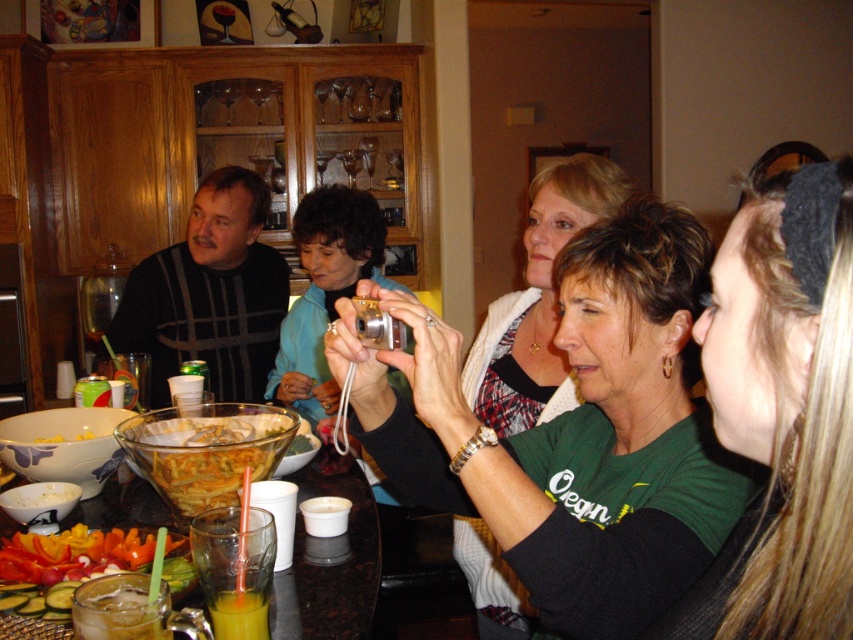
You are a guest at the party and want to take a photo of the green matte shirt at center without it being blocked by the translucent glass cup at lower left. Based on their sizes, is this possible?

The green matte shirt at center is taller than the translucent glass cup at lower left, so it might be possible to position the camera angle higher to ensure the shirt isn

You are at a party and want to grab a drink. You see the translucent glass cup at lower left and the yellow matte corn at center. Which object is closer to your current position if you are standing at the table?

The translucent glass cup at lower left is to the right of the yellow matte corn at center, so it is closer to your current position at the table.